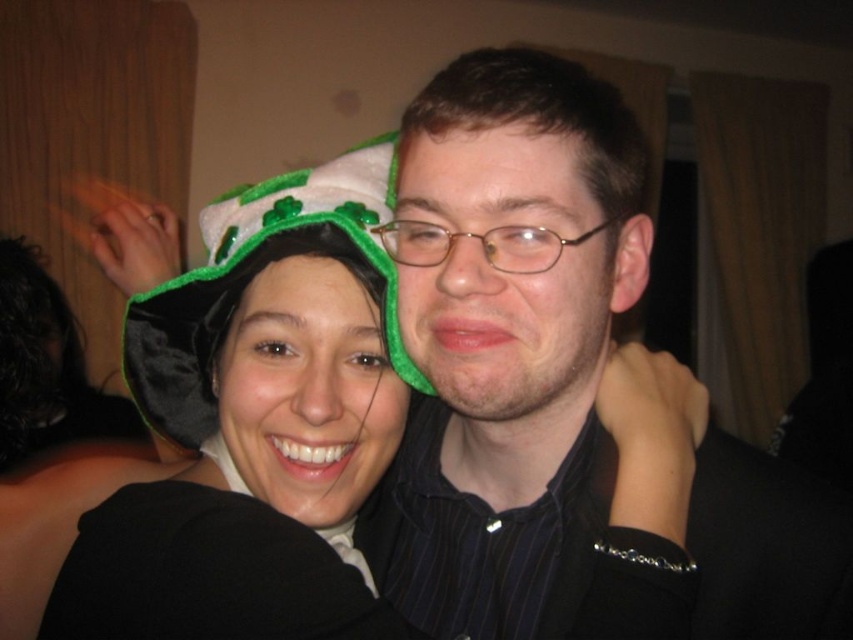
I want to click on velvet hat at center, so click(257, 428).